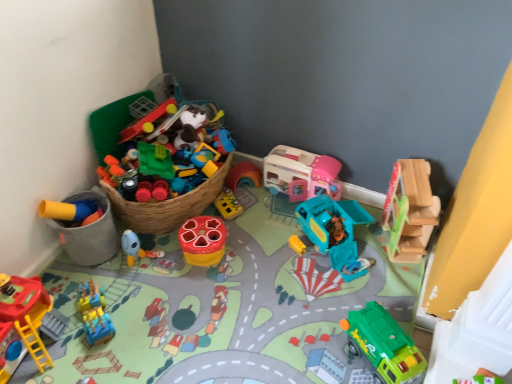
The image size is (512, 384). Identify the location of vacant space that is in between rubberized yellow toy at left, which appears as the 8th toy when viewed from the right, and blue rubber duck at center, which is the 3th toy in left-to-right order. (128, 264).